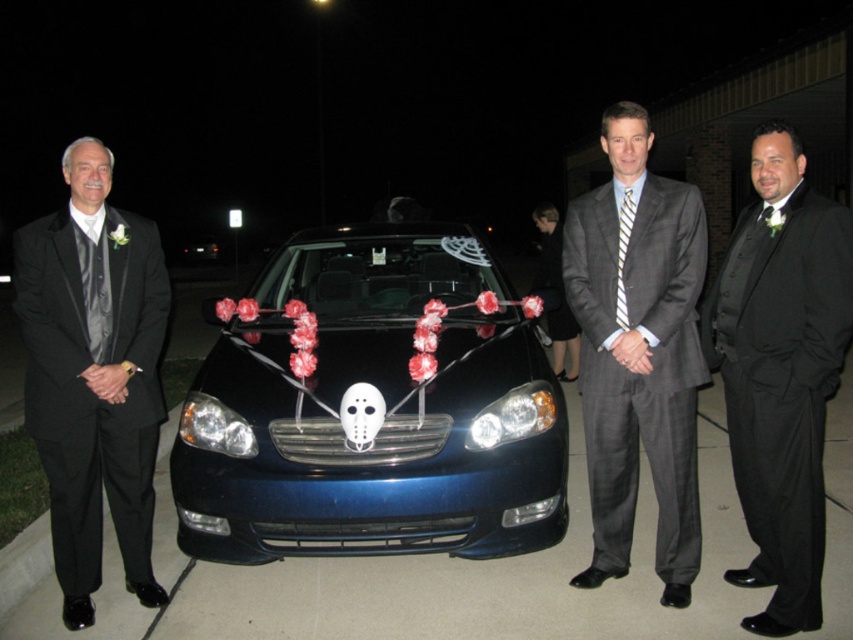
Is metallic blue car at center to the right of striped fabric tie at center from the viewer's perspective?

No, metallic blue car at center is not to the right of striped fabric tie at center.

Which is more to the right, metallic blue car at center or striped fabric tie at center?

striped fabric tie at center

Who is more distant from viewer, [374,464] or [619,266]?

The point [374,464] is behind.

The width and height of the screenshot is (853, 640). Find the location of `metallic blue car at center`. metallic blue car at center is located at coordinates (384, 420).

Does metallic blue car at center have a lesser width compared to black satin suit at center?

No.

Who is lower down, metallic blue car at center or black satin suit at center?

black satin suit at center is lower down.

Which is in front, point (386, 224) or point (792, 465)?

Point (792, 465) is more forward.

What are the coordinates of `metallic blue car at center` in the screenshot? It's located at (384, 420).

Does metallic blue car at center have a greater height compared to gray pinstripe suit at center?

In fact, metallic blue car at center may be shorter than gray pinstripe suit at center.

Is metallic blue car at center smaller than gray pinstripe suit at center?

No, metallic blue car at center is not smaller than gray pinstripe suit at center.

Locate an element on the screen. Image resolution: width=853 pixels, height=640 pixels. metallic blue car at center is located at coordinates (384, 420).

Find the location of `metallic blue car at center`. metallic blue car at center is located at coordinates (384, 420).